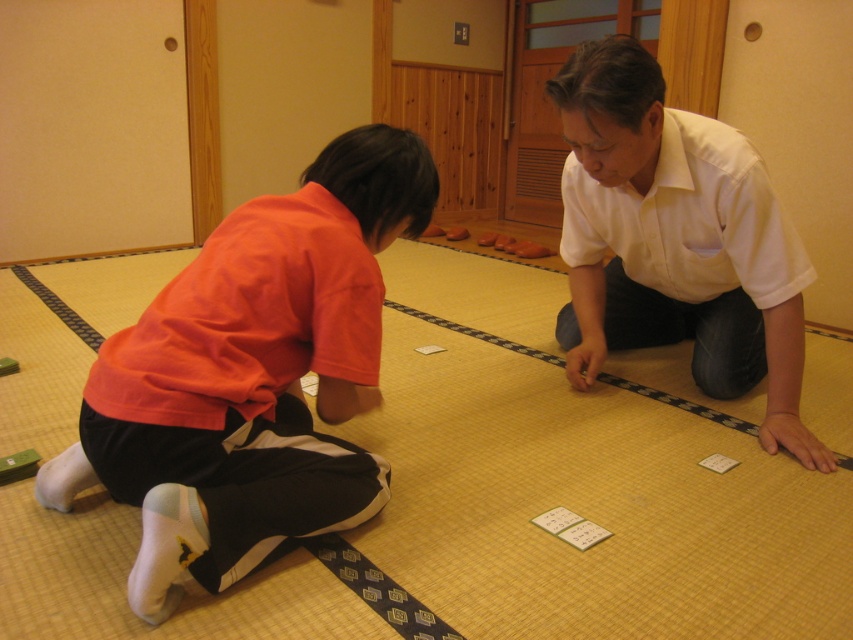
You are a photographer trying to capture a closeup of the white paper cards at center without including the orange cotton shirt at lower left in the frame. Based on their positions, is this possible?

The orange cotton shirt at lower left is to the left of white paper cards at center, so if you position yourself to the right side of the cards, you can capture the white paper cards at center without including the orange cotton shirt at lower left in the frame.

From the picture: You are a photographer trying to capture a closeup of the white paper cards at center without including the white matte shirt at center in the frame. Given their positions, is this possible?

The white matte shirt at center is further to the viewer than the white paper cards at center, meaning the shirt is closer to you. To avoid including the shirt, you can adjust your position or angle to focus solely on the cards behind it.